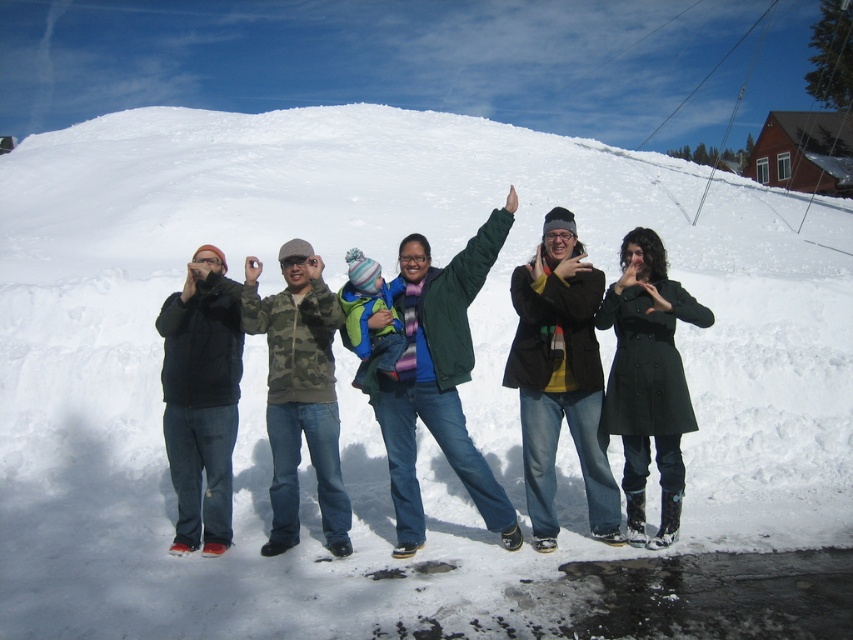
You are taking a photo of the group in the snow. You want to focus on the person in the black matte jacket at center and the person in the black matte jacket at left. Which jacket is closer to your camera?

The black matte jacket at center is closer to the viewer than the black matte jacket at left, so the camera should focus on the black matte jacket at center first as it is nearer.

You are a photographer trying to capture a photo of the group. You need to focus on the black matte jacket at center. Where should you aim your camera to ensure it is in the frame?

You should aim your camera at point (560, 378) to ensure the black matte jacket at center is in the frame.